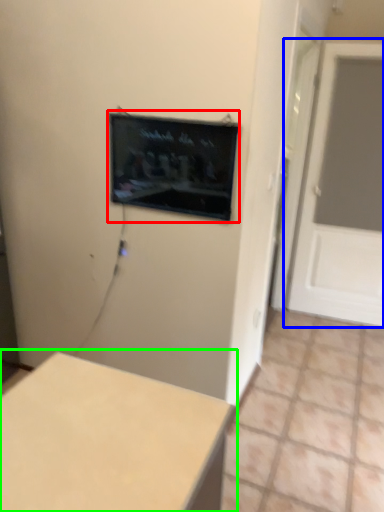
Question: Which is nearer to the computer screen (highlighted by a red box)? door (highlighted by a blue box) or table (highlighted by a green box).

Choices:
 (A) door
 (B) table

Answer: (B)